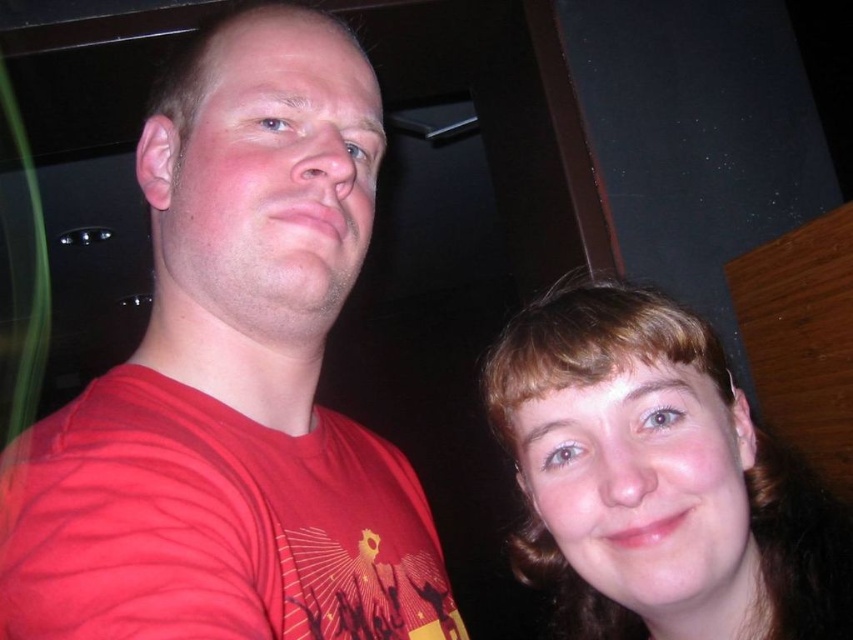
You are a photographer trying to place a spotlight at point (231, 384). Based on the scene, will the spotlight illuminate the matte red t shirt at left or the woman on the right?

The point (231, 384) is on matte red t shirt at left, so the spotlight will illuminate the matte red t shirt at left.